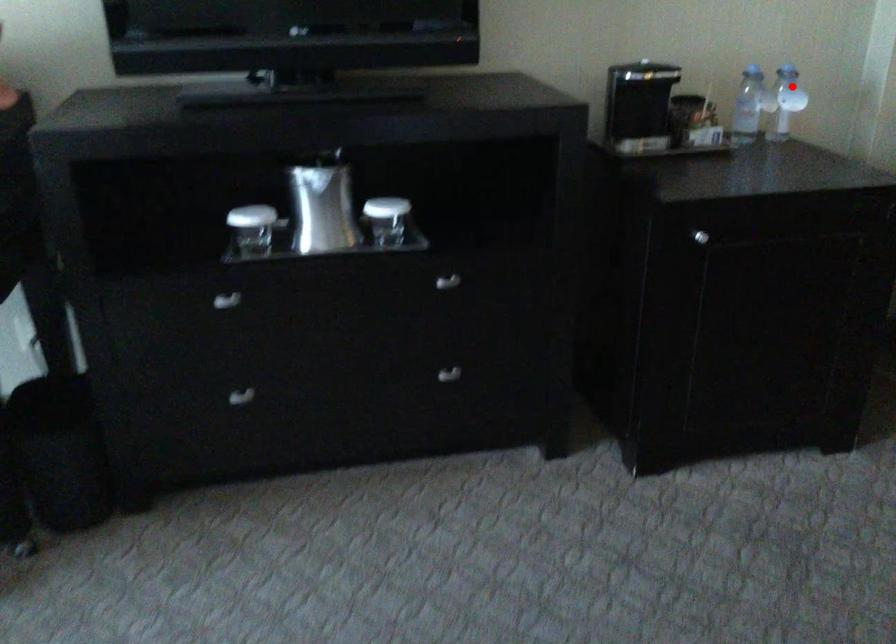
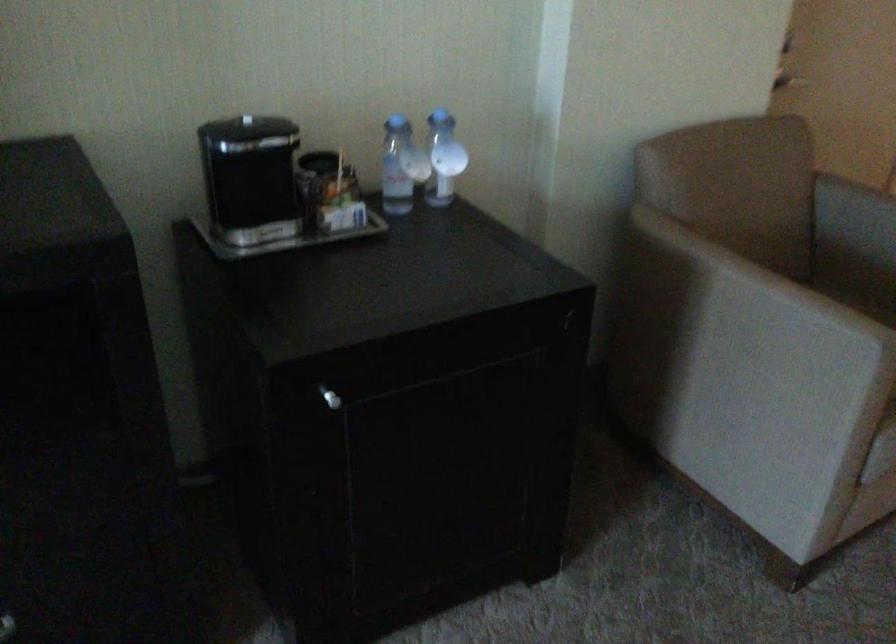
Find the pixel in the second image that matches the highlighted location in the first image.

(443, 158)